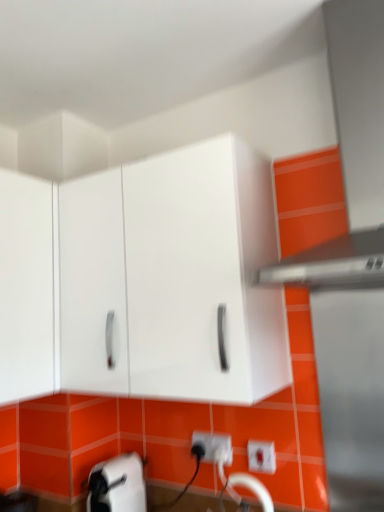
Question: Does white plastic electric outlet at lower center touch satin silver exhaust hood at upper right?

Choices:
 (A) yes
 (B) no

Answer: (B)

Question: Does white plastic electric outlet at lower center appear on the left side of satin silver exhaust hood at upper right?

Choices:
 (A) no
 (B) yes

Answer: (B)

Question: Considering the relative sizes of white plastic electric outlet at lower center and satin silver exhaust hood at upper right in the image provided, is white plastic electric outlet at lower center wider than satin silver exhaust hood at upper right?

Choices:
 (A) no
 (B) yes

Answer: (A)

Question: Does white plastic electric outlet at lower center appear on the right side of satin silver exhaust hood at upper right?

Choices:
 (A) no
 (B) yes

Answer: (A)

Question: From the image's perspective, is white plastic electric outlet at lower center below satin silver exhaust hood at upper right?

Choices:
 (A) no
 (B) yes

Answer: (B)

Question: Is white plastic electric outlet at lower center behind satin silver exhaust hood at upper right?

Choices:
 (A) no
 (B) yes

Answer: (B)

Question: Does satin silver exhaust hood at upper right turn towards white glossy cabinet at upper center?

Choices:
 (A) yes
 (B) no

Answer: (B)

Question: Is satin silver exhaust hood at upper right not close to white glossy cabinet at upper center?

Choices:
 (A) no
 (B) yes

Answer: (A)

Question: Can you confirm if satin silver exhaust hood at upper right is bigger than white glossy cabinet at upper center?

Choices:
 (A) no
 (B) yes

Answer: (A)

Question: Does satin silver exhaust hood at upper right have a greater width compared to white glossy cabinet at upper center?

Choices:
 (A) no
 (B) yes

Answer: (B)

Question: Considering the relative positions of satin silver exhaust hood at upper right and white glossy cabinet at upper center in the image provided, is satin silver exhaust hood at upper right behind white glossy cabinet at upper center?

Choices:
 (A) yes
 (B) no

Answer: (B)

Question: Does satin silver exhaust hood at upper right have a lesser height compared to white glossy cabinet at upper center?

Choices:
 (A) yes
 (B) no

Answer: (B)

Question: Does white plastic electric outlet at lower center appear on the right side of white glossy cabinet at upper center?

Choices:
 (A) yes
 (B) no

Answer: (A)